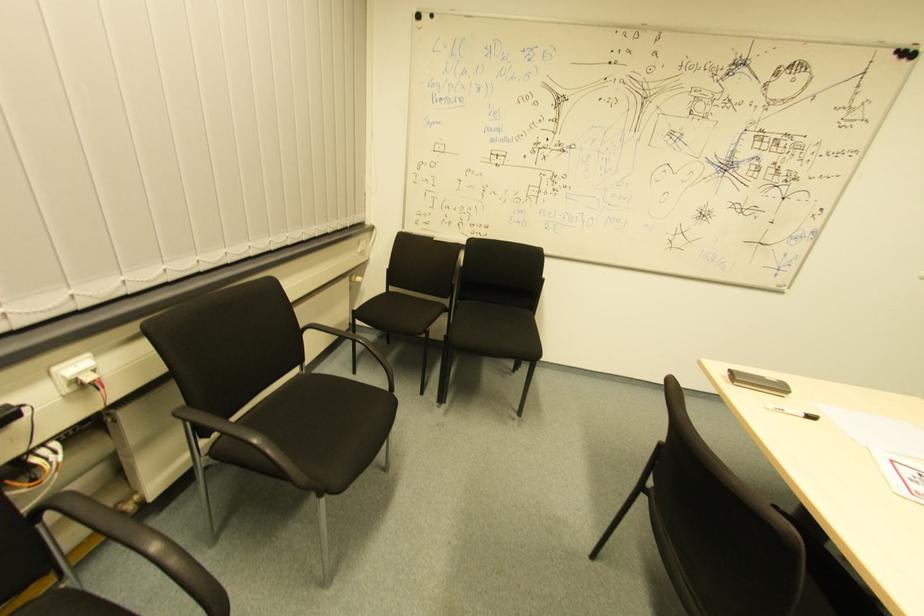
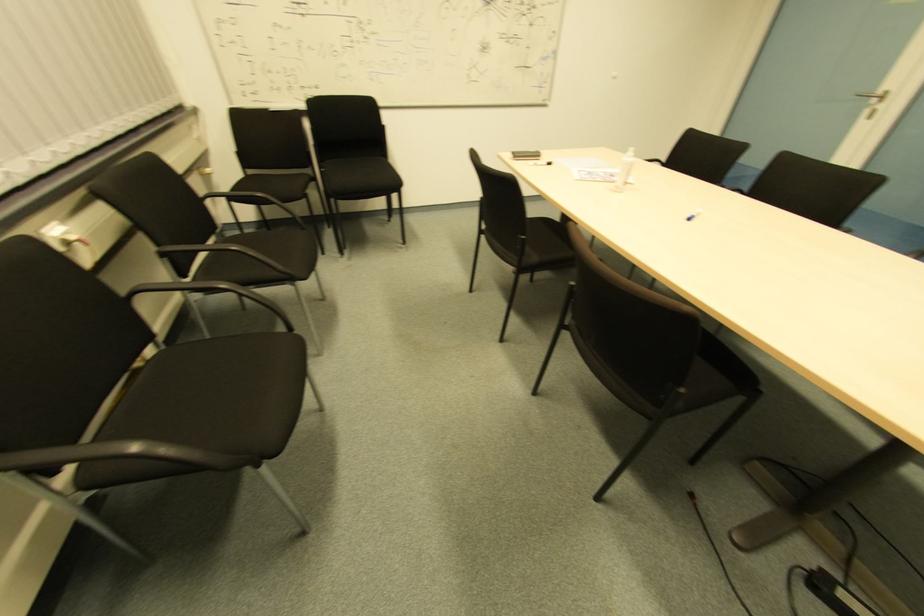
First-person continuous shooting, in which direction is the camera rotating?

The camera's rotation is toward right-down.